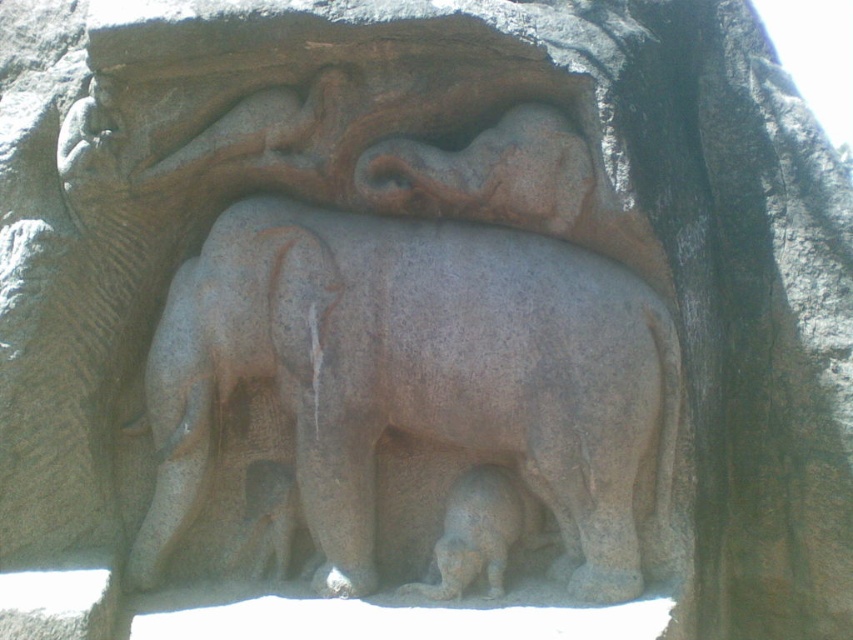
Question: Which of the following is the farthest from the observer?

Choices:
 (A) gray stone elephant at center
 (B) gray stone baby elephant at lower center

Answer: (B)

Question: Which point is farther from the camera taking this photo?

Choices:
 (A) [x=480, y=476]
 (B) [x=595, y=420]

Answer: (A)

Question: From the image, what is the correct spatial relationship of gray stone elephant at center in relation to gray stone baby elephant at lower center?

Choices:
 (A) left
 (B) right

Answer: (A)

Question: Considering the relative positions of gray stone elephant at center and gray stone baby elephant at lower center in the image provided, where is gray stone elephant at center located with respect to gray stone baby elephant at lower center?

Choices:
 (A) below
 (B) above

Answer: (B)

Question: Does gray stone elephant at center appear on the left side of gray stone baby elephant at lower center?

Choices:
 (A) yes
 (B) no

Answer: (A)